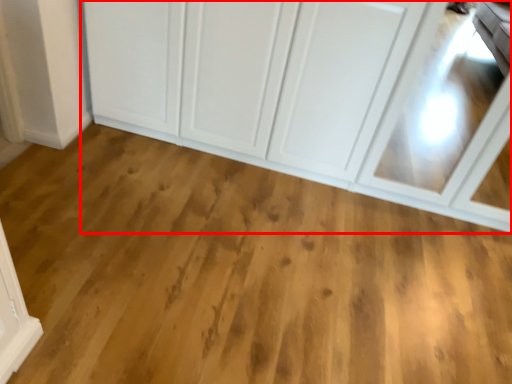
Question: From the image's perspective, what is the correct spatial relationship of cupboard (annotated by the red box) in relation to plain?

Choices:
 (A) above
 (B) below

Answer: (A)